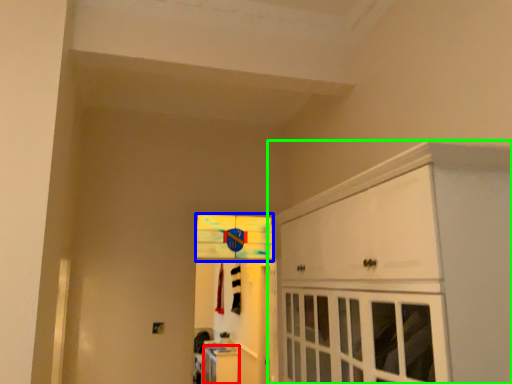
Question: Estimate the real-world distances between objects in this image. Which object is farther from cabinetry (highlighted by a red box), window (highlighted by a blue box) or cabinetry (highlighted by a green box)?

Choices:
 (A) window
 (B) cabinetry

Answer: (B)